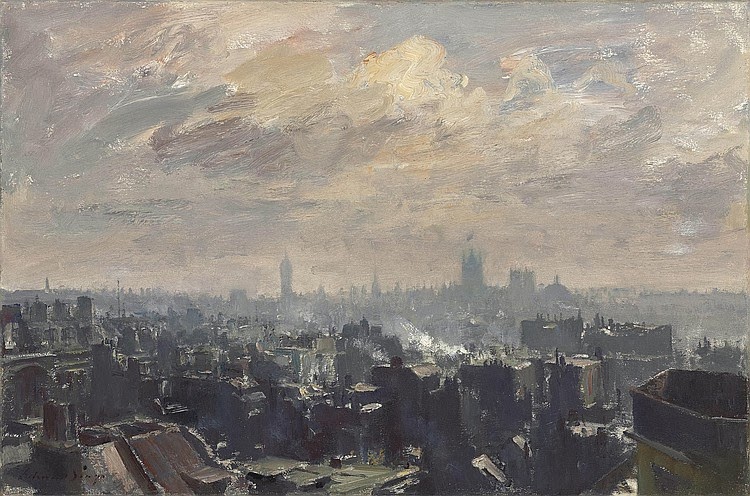
Locate an element on the screen. painting is located at coordinates (500, 428).